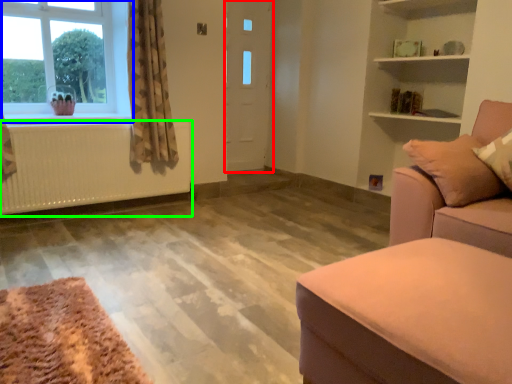
Question: Considering the real-world distances, which object is farthest from door (highlighted by a red box)? window (highlighted by a blue box) or radiator (highlighted by a green box)?

Choices:
 (A) window
 (B) radiator

Answer: (A)